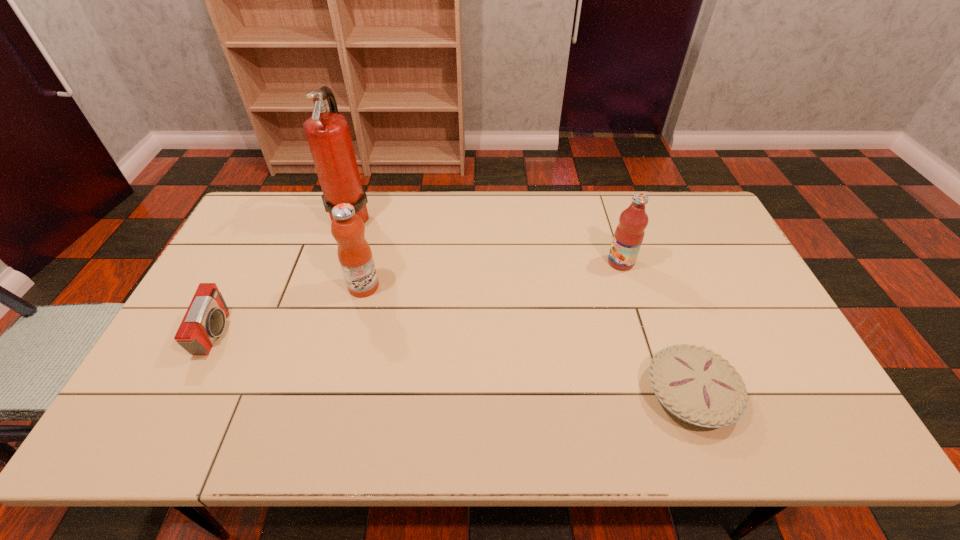
Find the location of `vacant space that satisfies the following two spatial constraints: 1. on the back side of the pie; 2. on the front label of the nearer fruit juice`. vacant space that satisfies the following two spatial constraints: 1. on the back side of the pie; 2. on the front label of the nearer fruit juice is located at coordinates (652, 287).

The width and height of the screenshot is (960, 540). What are the coordinates of `free space that satisfies the following two spatial constraints: 1. on the front-facing side of the shortest object; 2. on the left side of the camera` in the screenshot? It's located at (184, 394).

Where is `free point that satisfies the following two spatial constraints: 1. on the front label of the shortest object; 2. on the left side of the third farthest object`? The width and height of the screenshot is (960, 540). free point that satisfies the following two spatial constraints: 1. on the front label of the shortest object; 2. on the left side of the third farthest object is located at coordinates (337, 394).